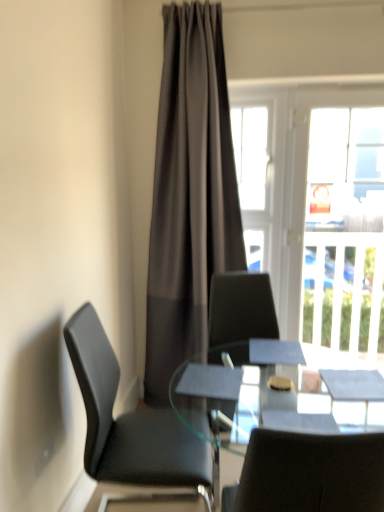
Question: Should I look upward or downward to see black leather chair at left?

Choices:
 (A) up
 (B) down

Answer: (B)

Question: Is the surface of clear glass window at upper right in direct contact with transparent glass table at center?

Choices:
 (A) yes
 (B) no

Answer: (B)

Question: Could you tell me if clear glass window at upper right is facing transparent glass table at center?

Choices:
 (A) yes
 (B) no

Answer: (A)

Question: Can we say clear glass window at upper right lies outside transparent glass table at center?

Choices:
 (A) yes
 (B) no

Answer: (A)

Question: Is clear glass window at upper right facing away from transparent glass table at center?

Choices:
 (A) yes
 (B) no

Answer: (B)

Question: Is clear glass window at upper right not near transparent glass table at center?

Choices:
 (A) no
 (B) yes

Answer: (B)

Question: Considering the relative sizes of clear glass window at upper right and transparent glass table at center in the image provided, is clear glass window at upper right shorter than transparent glass table at center?

Choices:
 (A) no
 (B) yes

Answer: (A)

Question: Does transparent glass table at center have a lesser width compared to black leather chair at left?

Choices:
 (A) yes
 (B) no

Answer: (B)

Question: Is transparent glass table at center not within black leather chair at left?

Choices:
 (A) yes
 (B) no

Answer: (A)

Question: From the image's perspective, is transparent glass table at center under black leather chair at left?

Choices:
 (A) no
 (B) yes

Answer: (B)

Question: Is transparent glass table at center beside black leather chair at left?

Choices:
 (A) yes
 (B) no

Answer: (B)

Question: Is black leather chair at left at the back of transparent glass table at center?

Choices:
 (A) no
 (B) yes

Answer: (B)

Question: Is black leather chair at left inside transparent glass table at center?

Choices:
 (A) no
 (B) yes

Answer: (A)

Question: Is dark gray sheer curtain at center aimed at black leather chair at left?

Choices:
 (A) yes
 (B) no

Answer: (A)